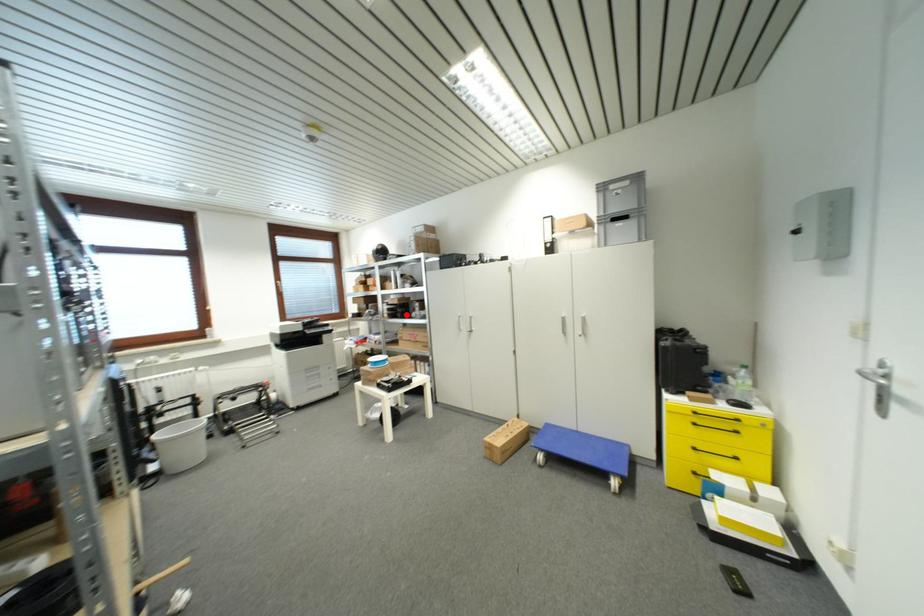
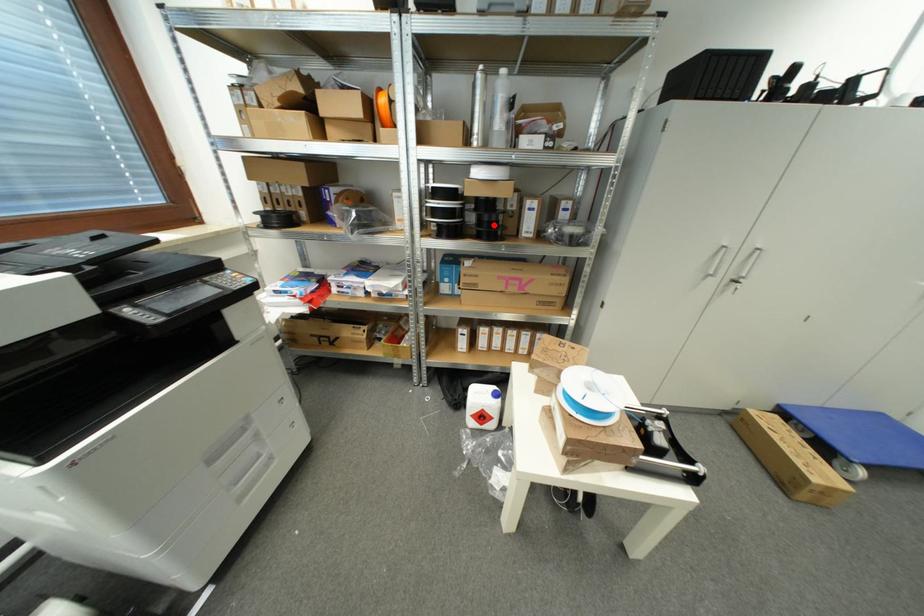
I am providing you with two images of the same scene from different viewpoints. A red point is marked on the first image and another point is marked on the second image. Do the highlighted points in image1 and image2 indicate the same real-world spot?

Yes